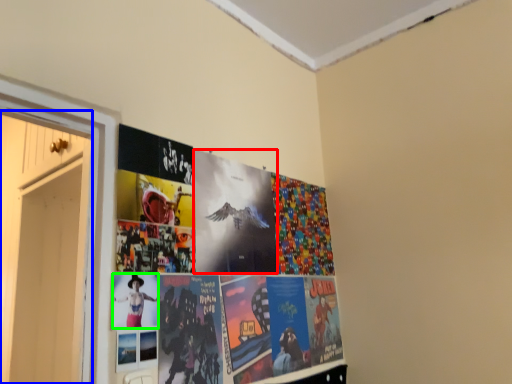
Question: Considering the real-world distances, which object is farthest from flyer (highlighted by a red box)? door (highlighted by a blue box) or person (highlighted by a green box)?

Choices:
 (A) door
 (B) person

Answer: (A)